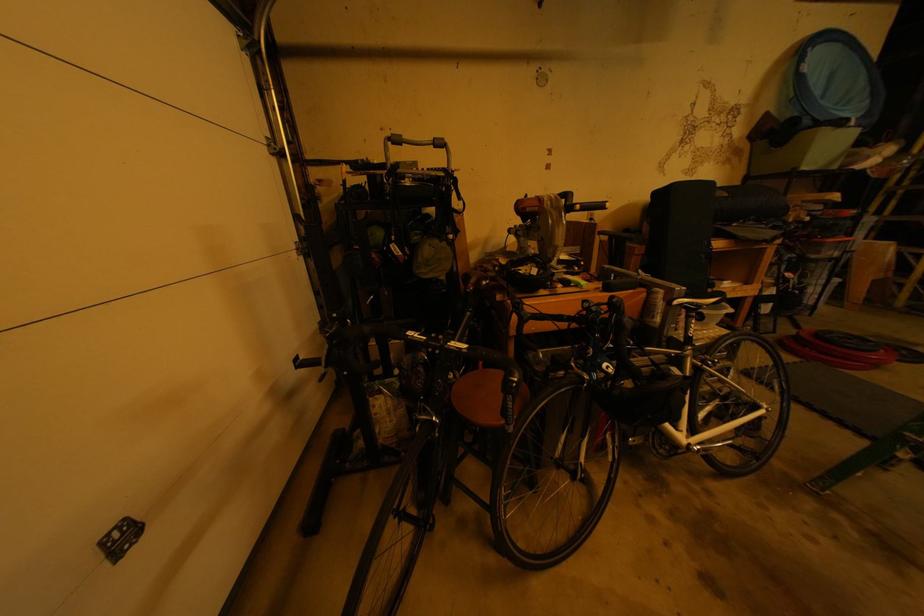
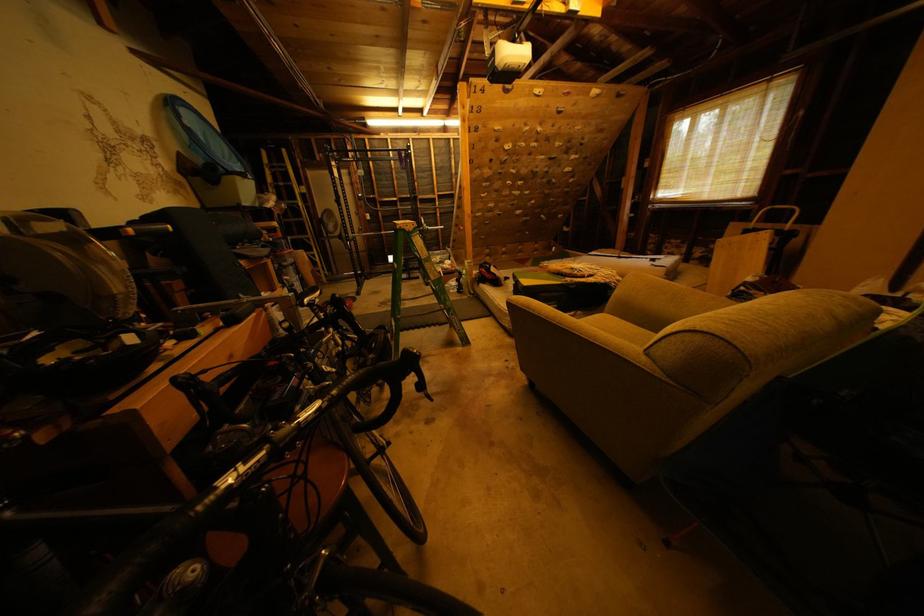
Based on the continuous images, in which direction is the camera rotating?

The camera's rotation is toward right-down.